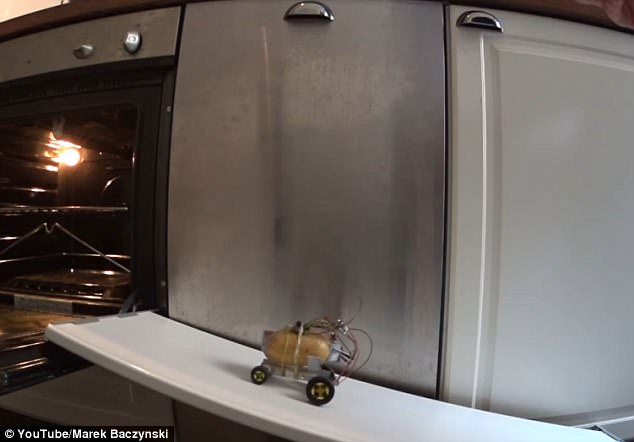
You are a GUI agent. You are given a task and a screenshot of the screen. Output one action in this format:
    pyautogui.click(x=<x>, y=<y>)
    Task: Click on the cabinet hinge
    
    Given the screenshot: What is the action you would take?
    pyautogui.click(x=494, y=30)